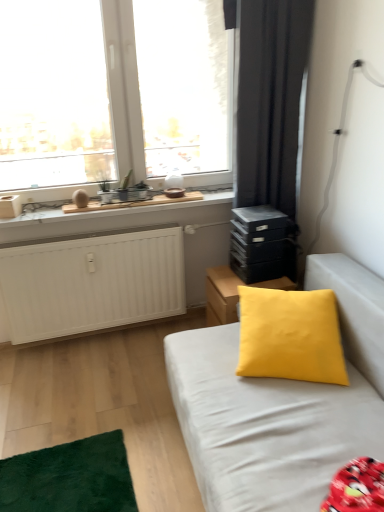
Locate an element on the screen. The height and width of the screenshot is (512, 384). vacant area situated to the left side of black matte stack of drawers at right is located at coordinates (228, 276).